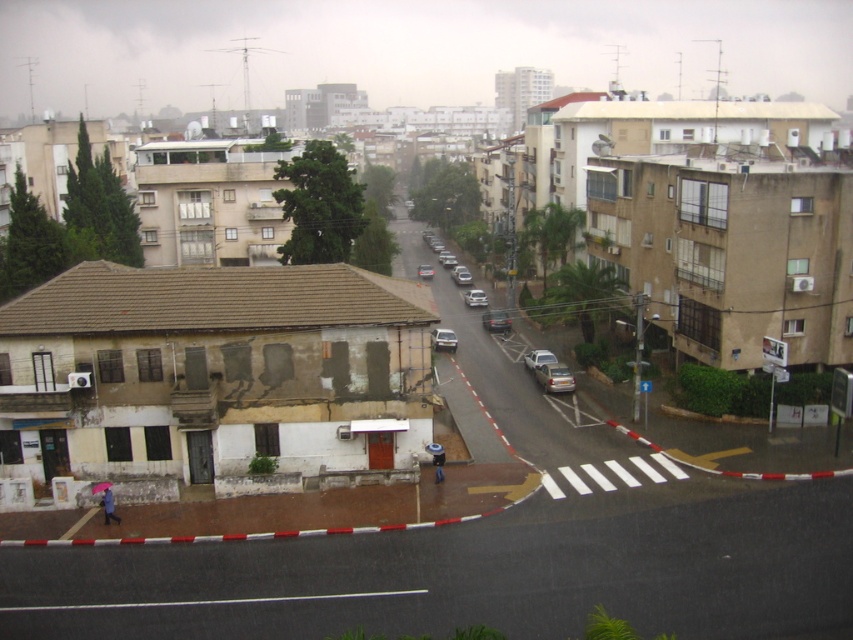
Can you confirm if metallic silver car at center is thinner than silver metallic car at center-right?

Correct, metallic silver car at center's width is less than silver metallic car at center-right's.

Is point (444, 340) less distant than point (527, 353)?

No, (444, 340) is further to viewer.

Describe the element at coordinates (444, 339) in the screenshot. I see `metallic silver car at center` at that location.

Image resolution: width=853 pixels, height=640 pixels. What are the coordinates of `metallic silver car at center` in the screenshot? It's located at (444, 339).

Does silver metallic car at center-right have a larger size compared to matte silver sedan at center?

Incorrect, silver metallic car at center-right is not larger than matte silver sedan at center.

Between point (552, 355) and point (431, 275), which one is positioned in front?

Point (552, 355) is more forward.

The width and height of the screenshot is (853, 640). In order to click on silver metallic car at center-right in this screenshot , I will do `click(538, 356)`.

Locate an element on the screen. This screenshot has height=640, width=853. silver metallic car at center-right is located at coordinates (538, 356).

Looking at this image, which is more to the left, silver metallic sedan at center-right or shiny silver sedan at center?

Positioned to the left is shiny silver sedan at center.

Identify the location of silver metallic sedan at center-right. This screenshot has height=640, width=853. (554, 378).